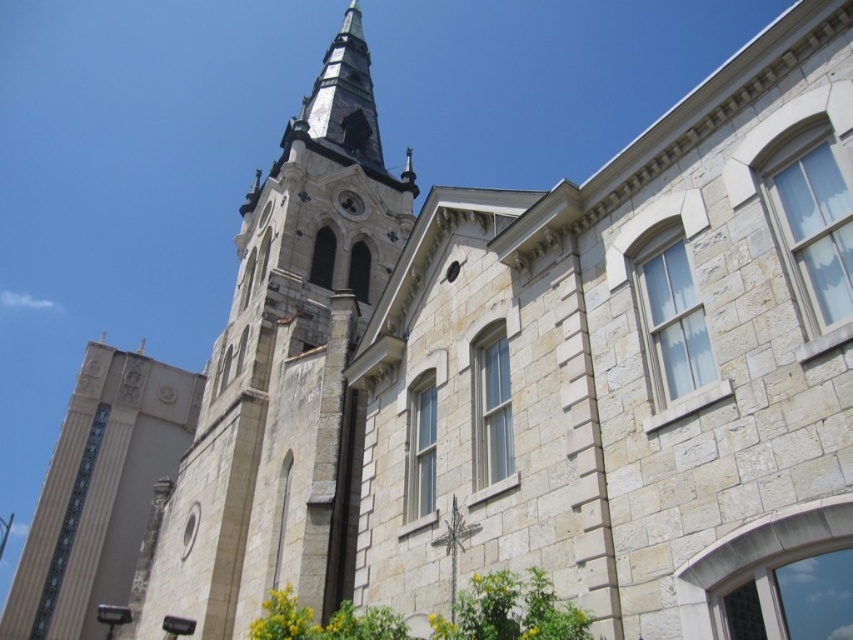
What do you see at coordinates (283, 376) in the screenshot?
I see `stone steeple at center` at bounding box center [283, 376].

Between stone steeple at center and beige stone tower at center, which one appears on the left side from the viewer's perspective?

beige stone tower at center is more to the left.

Image resolution: width=853 pixels, height=640 pixels. I want to click on stone steeple at center, so click(283, 376).

You are a GUI agent. You are given a task and a screenshot of the screen. Output one action in this format:
    pyautogui.click(x=<x>, y=<y>)
    Task: Click on the stone steeple at center
    The image size is (853, 640).
    Given the screenshot: What is the action you would take?
    pyautogui.click(x=283, y=376)